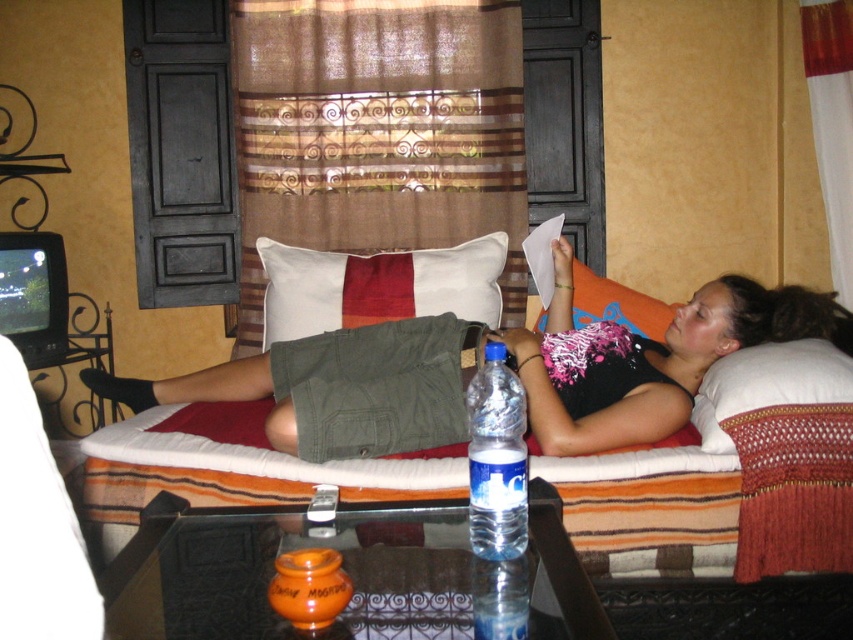
You are organizing a clothing donation drive and need to determine which item takes up more space between the matte black shirt at center and the white cotton pillow at center. Which one should you prioritize packing first?

The matte black shirt at center has a larger size compared to the white cotton pillow at center, so you should prioritize packing the matte black shirt at center first as it requires more space.

Consider the image. You are a delivery person who needs to place a package on the glass coffee table in front of the bed. However, there is already a matte black shirt at center and a clear plastic bottle at center on the table. Which object should you move to make space for the package?

The clear plastic bottle at center should be moved because the matte black shirt at center is much taller and likely takes up more vertical space, making it harder to move without disturbing the person.